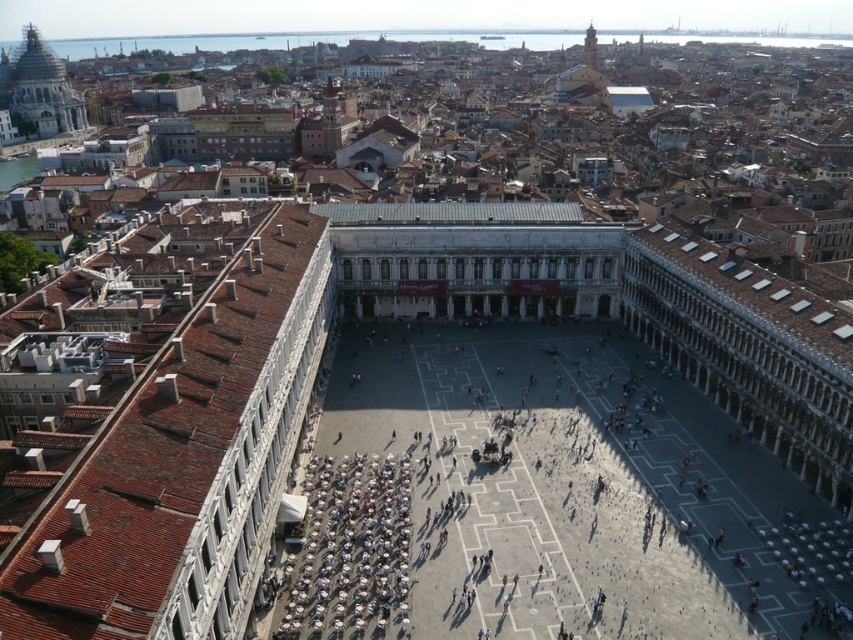
You are a tourist standing at the edge of St. Mark Square in Venice. You see the white stone square at center and the terracotta tiled roof at left. Which one is closer to your current position?

The white stone square at center is closer to your current position because it is located below the terracotta tiled roof at left, indicating it is situated lower in elevation and closer to the ground level.

You are a photographer standing at the center of St. Mark Square. You want to take a photo that includes both the terracotta tiled roof at left and the white plastic chairs at lower left. Which object will appear larger in the photo?

The terracotta tiled roof at left will appear larger in the photo because it has a greater height compared to the white plastic chairs at lower left.